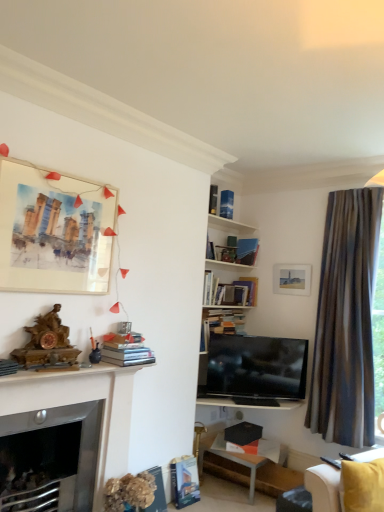
Question: From a real-world perspective, does hardcover book at lower center, acting as the seventh book starting from the top, sit lower than hardcover book at lower center, placed as the first book when sorted from bottom to top?

Choices:
 (A) no
 (B) yes

Answer: (A)

Question: Considering the relative positions of hardcover book at lower center, the second book from the bottom, and hardcover book at lower center, acting as the eighth book starting from the top, in the image provided, is hardcover book at lower center, the second book from the bottom, behind hardcover book at lower center, acting as the eighth book starting from the top,?

Choices:
 (A) yes
 (B) no

Answer: (A)

Question: Considering the relative sizes of hardcover book at lower center, the second book from the bottom, and hardcover book at lower center, acting as the eighth book starting from the top, in the image provided, is hardcover book at lower center, the second book from the bottom, smaller than hardcover book at lower center, acting as the eighth book starting from the top,?

Choices:
 (A) no
 (B) yes

Answer: (A)

Question: Does hardcover book at lower center, acting as the seventh book starting from the top, appear on the right side of hardcover book at lower center, acting as the eighth book starting from the top?

Choices:
 (A) no
 (B) yes

Answer: (B)

Question: From the image's perspective, is hardcover book at lower center, acting as the seventh book starting from the top, located above hardcover book at lower center, acting as the eighth book starting from the top?

Choices:
 (A) no
 (B) yes

Answer: (B)

Question: Relative to brown striped curtain at right, is black glossy tv at center in front or behind?

Choices:
 (A) behind
 (B) front

Answer: (A)

Question: Considering the positions of black glossy tv at center and brown striped curtain at right in the image, is black glossy tv at center bigger or smaller than brown striped curtain at right?

Choices:
 (A) big
 (B) small

Answer: (B)

Question: Is black glossy tv at center taller or shorter than brown striped curtain at right?

Choices:
 (A) tall
 (B) short

Answer: (B)

Question: In the image, is black glossy tv at center on the left side or the right side of brown striped curtain at right?

Choices:
 (A) right
 (B) left

Answer: (B)

Question: Does point (225, 218) appear closer or farther from the camera than point (213, 199)?

Choices:
 (A) closer
 (B) farther

Answer: (B)

Question: Is white wooden shelves at upper center spatially inside hardcover book at upper center, placed as the 1th book when sorted from top to bottom, or outside of it?

Choices:
 (A) outside
 (B) inside

Answer: (A)

Question: In the image, is white wooden shelves at upper center positioned in front of or behind hardcover book at upper center, which ranks as the eighth book in bottom-to-top order?

Choices:
 (A) front
 (B) behind

Answer: (A)

Question: Looking at their shapes, would you say white wooden shelves at upper center is wider or thinner than hardcover book at upper center, placed as the 1th book when sorted from top to bottom?

Choices:
 (A) thin
 (B) wide

Answer: (B)

Question: In the image, is hardcover book at upper center, which ranks as the eighth book in bottom-to-top order, positioned in front of or behind hardcover book at lower center, the second book from the bottom?

Choices:
 (A) behind
 (B) front

Answer: (A)

Question: Considering the positions of hardcover book at upper center, which ranks as the eighth book in bottom-to-top order, and hardcover book at lower center, the second book from the bottom, in the image, is hardcover book at upper center, which ranks as the eighth book in bottom-to-top order, taller or shorter than hardcover book at lower center, the second book from the bottom,?

Choices:
 (A) tall
 (B) short

Answer: (B)